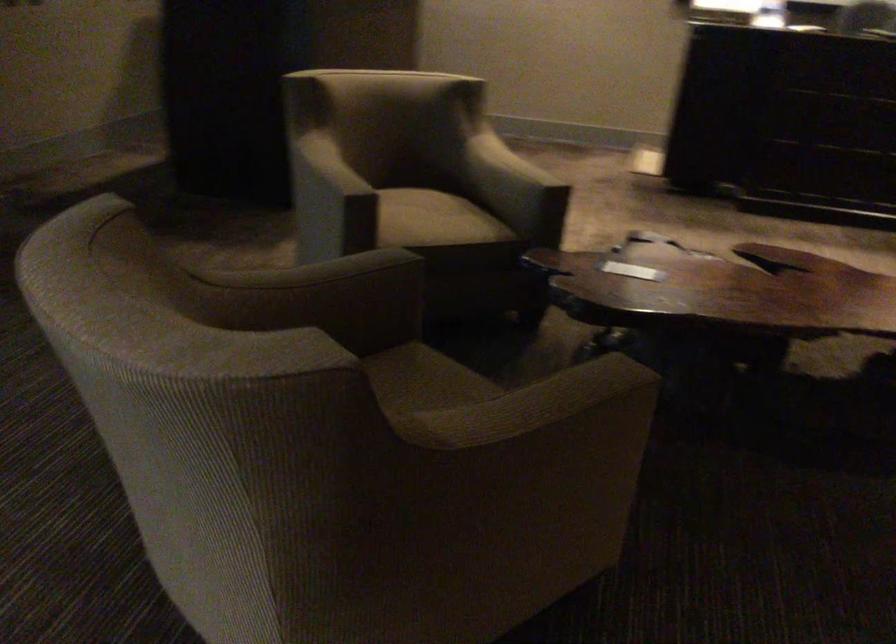
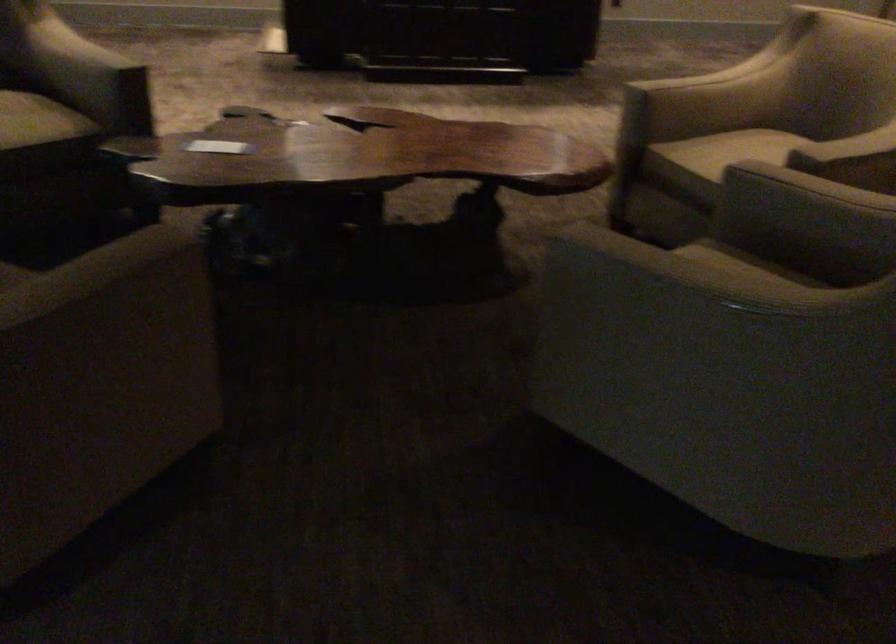
The point at [627,270] is marked in the first image. Where is the corresponding point in the second image?

(218, 146)